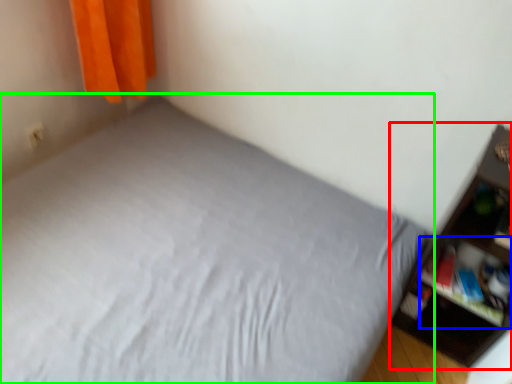
Question: Estimate the real-world distances between objects in this image. Which object is closer to shelf (highlighted by a red box), cabinet (highlighted by a blue box) or bed (highlighted by a green box)?

Choices:
 (A) cabinet
 (B) bed

Answer: (A)